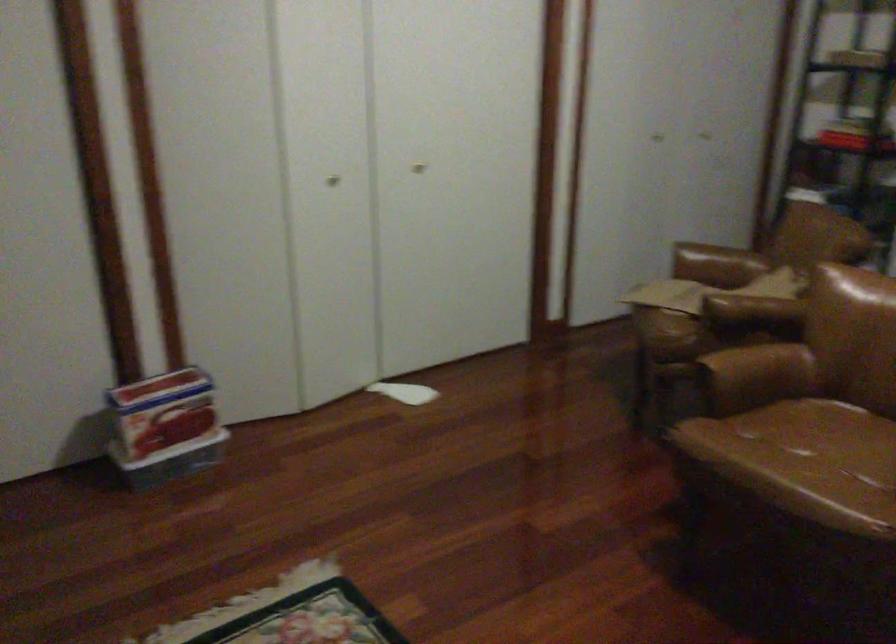
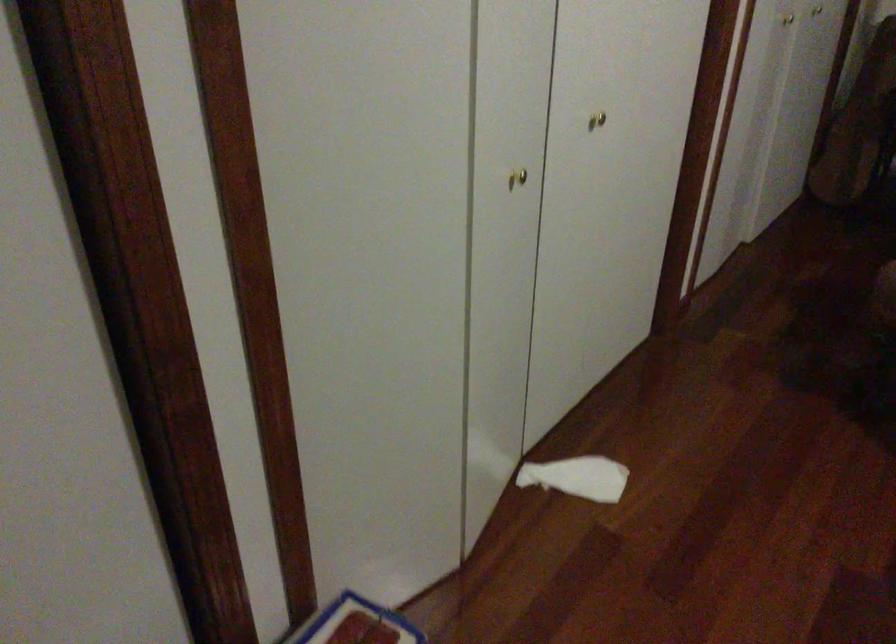
Where in the second image is the point corresponding to pixel 339 178 from the first image?

(517, 178)